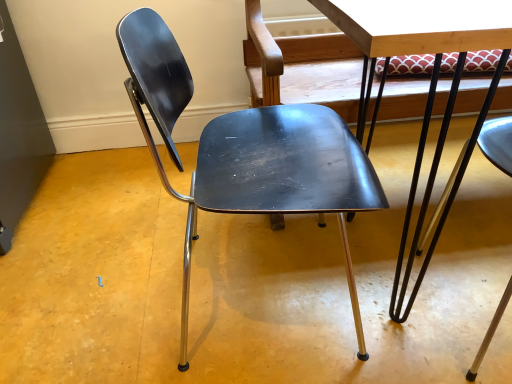
Image resolution: width=512 pixels, height=384 pixels. Identify the location of vacant space to the left of matte black chair at center. (109, 286).